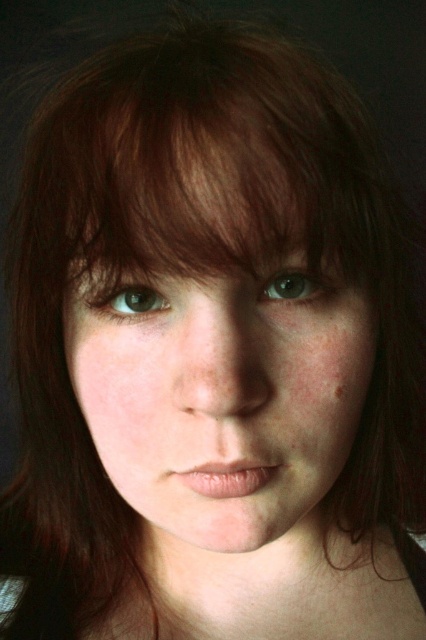
You are an optometrist examining a patient. You notice the green matte eye at center and the brown matte eye at center. Which eye is positioned closer to your viewpoint?

The green matte eye at center is closer to the viewer than the brown matte eye at center.

You are taking a photo of a person with reddish brown hair and freckles. You want to focus on the point closer to the camera between point (316, 291) and point (336, 396). Which point should you choose?

Point (316, 291) is closer to the camera than point (336, 396), so you should choose point (316, 291).

You are a photographer adjusting the focus on your camera. You notice two points in the portrait you are taking. The first point is at coordinates point (92, 300) and the second is at point (334, 381). Which point should you focus on to ensure it appears sharper in the final image?

You should focus on point (92, 300) because it is closer to the camera than point (334, 381), making it appear sharper in the final image.